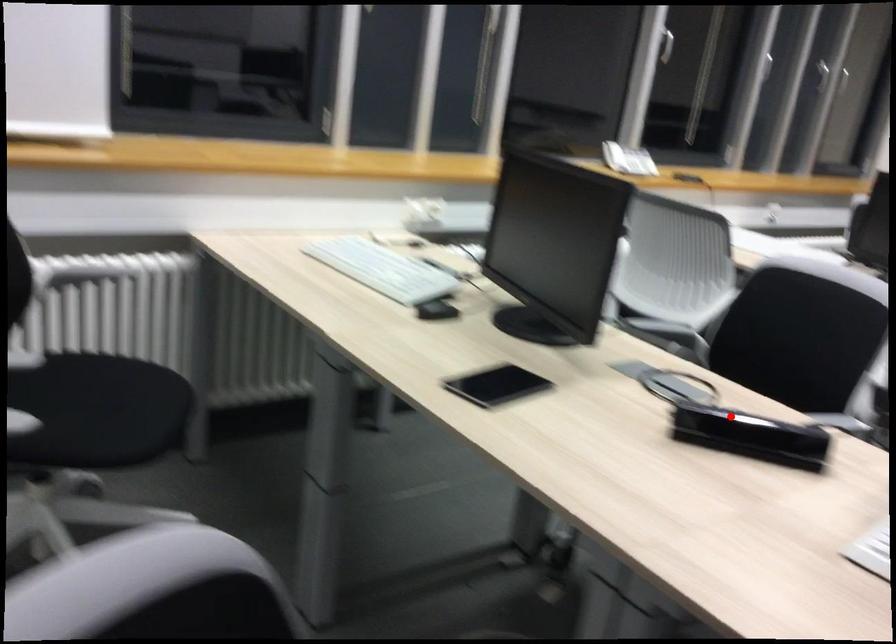
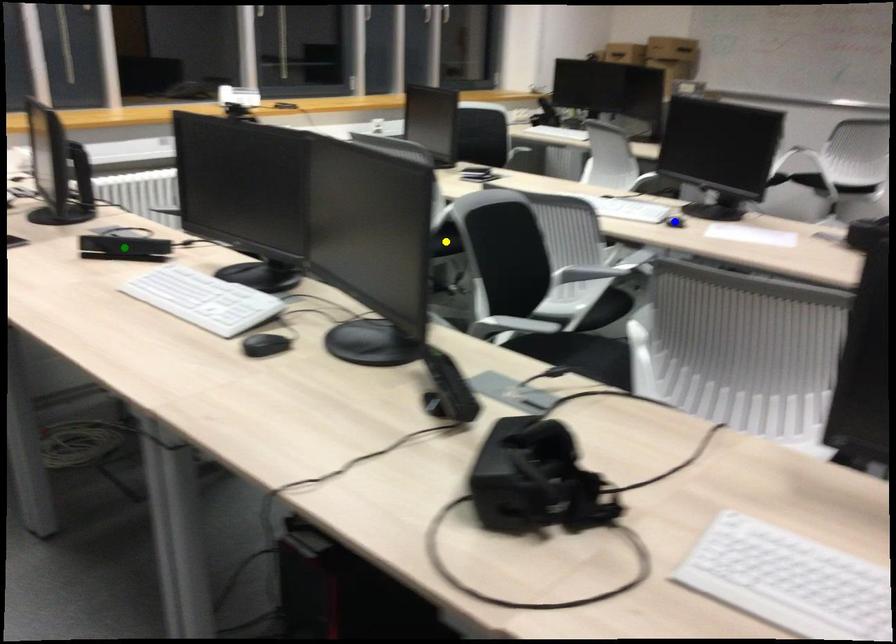
Question: I am providing you with two images of the same scene from different viewpoints. A red point is marked on the first image. You are given multiple points on the second image. Which spot in image 2 lines up with the point in image 1?

Choices:
 (A) green point
 (B) blue point
 (C) yellow point

Answer: (A)